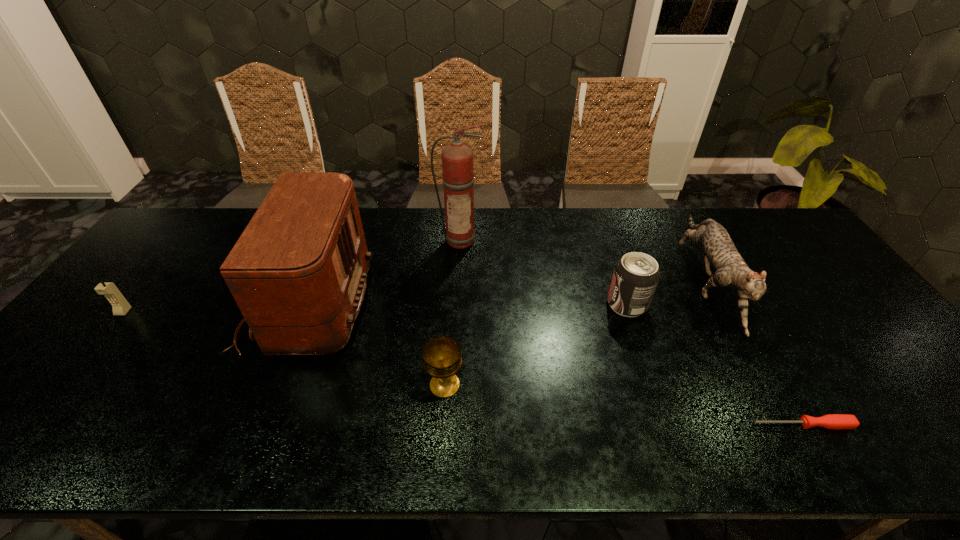
Identify the location of blank region between the sixth object from right to left and the chalice. The image size is (960, 540). (376, 345).

Find the location of a particular element. The height and width of the screenshot is (540, 960). free space between the screwdriver and the fifth object from left to right is located at coordinates (714, 364).

Locate an element on the screen. This screenshot has width=960, height=540. empty location between the soda can and the shortest object is located at coordinates (714, 364).

At what (x,y) coordinates should I click in order to perform the action: click on vacant space that's between the fire extinguisher and the soda can. Please return your answer as a coordinate pair (x, y). Looking at the image, I should click on (543, 272).

Locate an element on the screen. The image size is (960, 540). vacant region between the fifth object from left to right and the second tallest object is located at coordinates (468, 304).

What are the coordinates of `free spot between the cat and the second object from left to right` in the screenshot? It's located at (506, 293).

Select which object is the fourth closest to the fifth object from left to right. Please provide its 2D coordinates. Your answer should be formatted as a tuple, i.e. [(x, y)], where the tuple contains the x and y coordinates of a point satisfying the conditions above.

[(442, 357)]

This screenshot has width=960, height=540. I want to click on object identified as the third closest to the leftmost object, so [x=457, y=158].

The width and height of the screenshot is (960, 540). I want to click on vacant area in the image that satisfies the following two spatial constraints: 1. on the front panel of the sixth object from right to left; 2. on the front of the cellular telephone, where the keypad is located, so click(304, 312).

Where is `free space in the image that satisfies the following two spatial constraints: 1. on the side of the third object from right to left with the label and nozzle; 2. on the right side of the tallest object`? The height and width of the screenshot is (540, 960). free space in the image that satisfies the following two spatial constraints: 1. on the side of the third object from right to left with the label and nozzle; 2. on the right side of the tallest object is located at coordinates (457, 304).